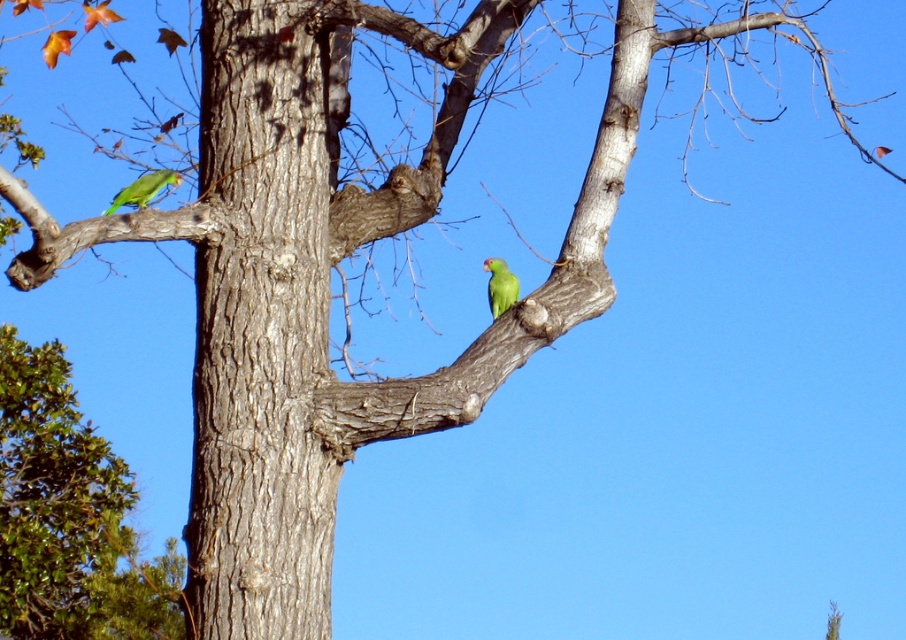
Question: In this image, where is green matte parrot at left located relative to green matte parrot at center?

Choices:
 (A) right
 (B) left

Answer: (B)

Question: Which of the following is the closest to the observer?

Choices:
 (A) green matte parrot at left
 (B) green matte parrot at center
 (C) smooth bark tree trunk at center

Answer: (C)

Question: Which point appears farthest from the camera in this image?

Choices:
 (A) (140, 189)
 (B) (516, 289)

Answer: (B)

Question: Which point appears closest to the camera in this image?

Choices:
 (A) (132, 193)
 (B) (191, 634)
 (C) (495, 262)

Answer: (B)

Question: Is smooth bark tree trunk at center smaller than green matte parrot at left?

Choices:
 (A) no
 (B) yes

Answer: (A)

Question: Does smooth bark tree trunk at center lie behind green matte parrot at center?

Choices:
 (A) no
 (B) yes

Answer: (A)